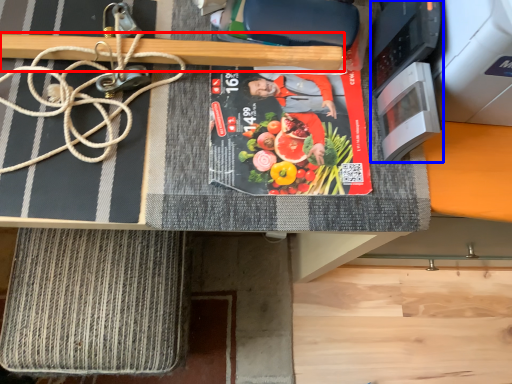
Question: Among these objects, which one is farthest to the camera, wood (highlighted by a red box) or appliance (highlighted by a blue box)?

Choices:
 (A) wood
 (B) appliance

Answer: (A)